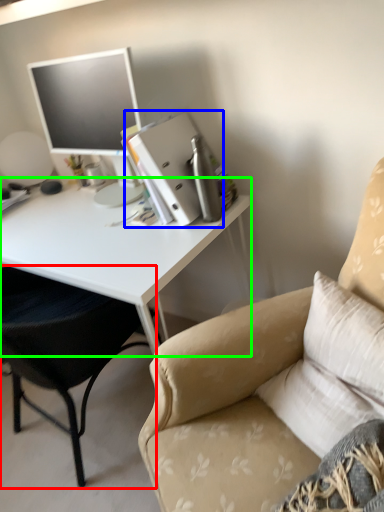
Question: Which object is positioned farthest from chair (highlighted by a red box)? Select from binder (highlighted by a blue box) and desk (highlighted by a green box).

Choices:
 (A) binder
 (B) desk

Answer: (A)